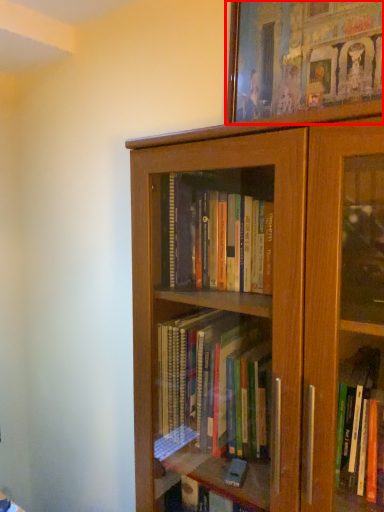
Question: In this image, where is picture frame (annotated by the red box) located relative to bookcase?

Choices:
 (A) right
 (B) left

Answer: (A)